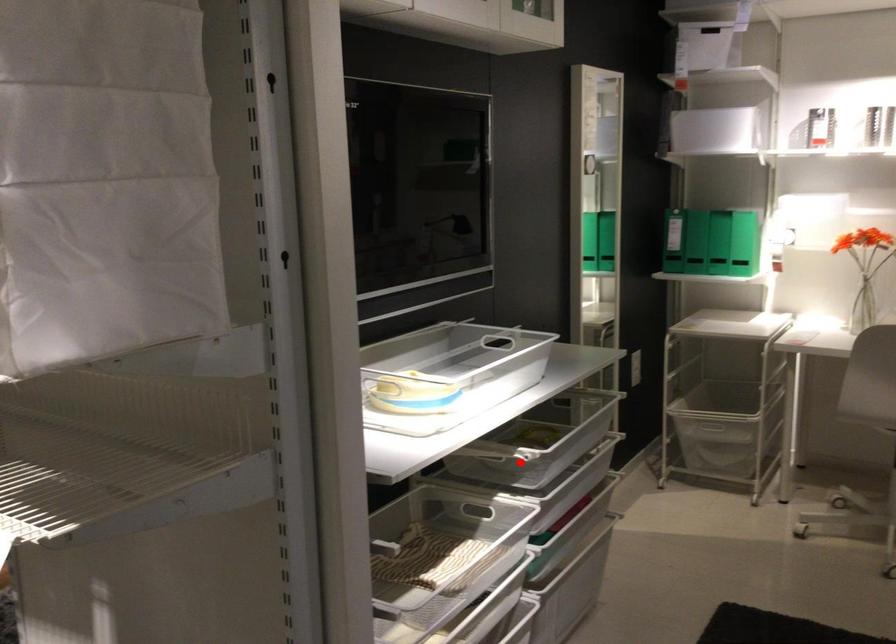
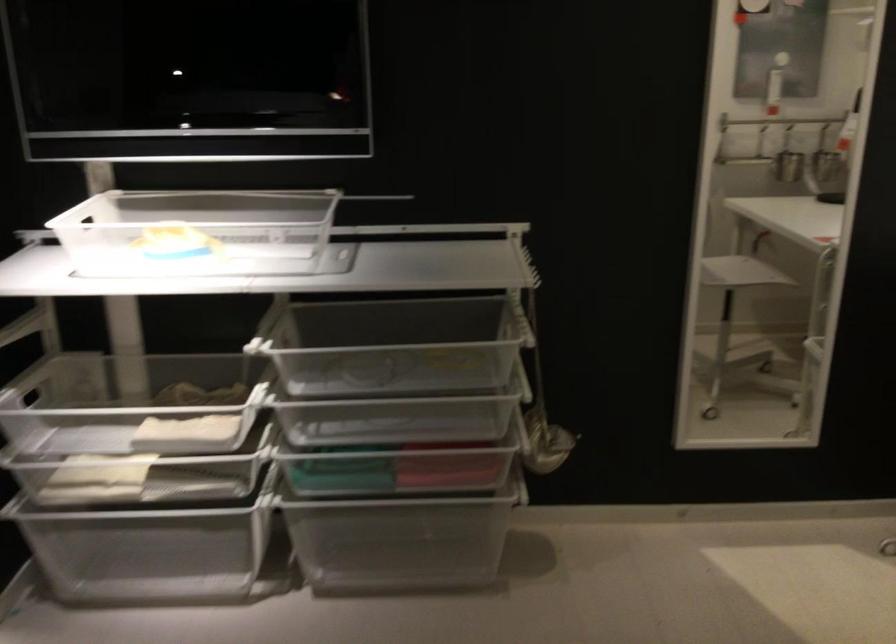
The point at the highlighted location is marked in the first image. Where is the corresponding point in the second image?

(397, 406)